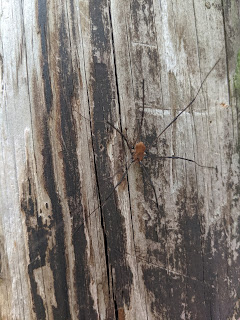
Image resolution: width=240 pixels, height=320 pixels. In order to click on wood surface in this screenshot , I will do `click(57, 147)`.